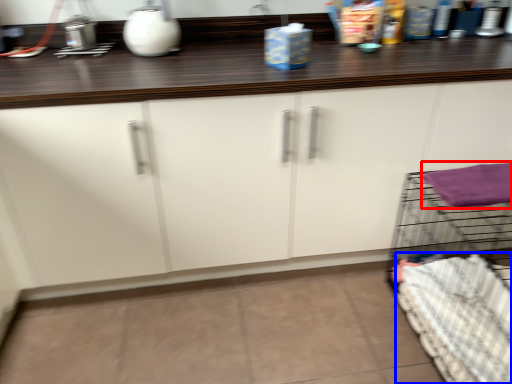
Question: Which of the following is the farthest to the observer, bath towel (highlighted by a red box) or bedding (highlighted by a blue box)?

Choices:
 (A) bath towel
 (B) bedding

Answer: (A)